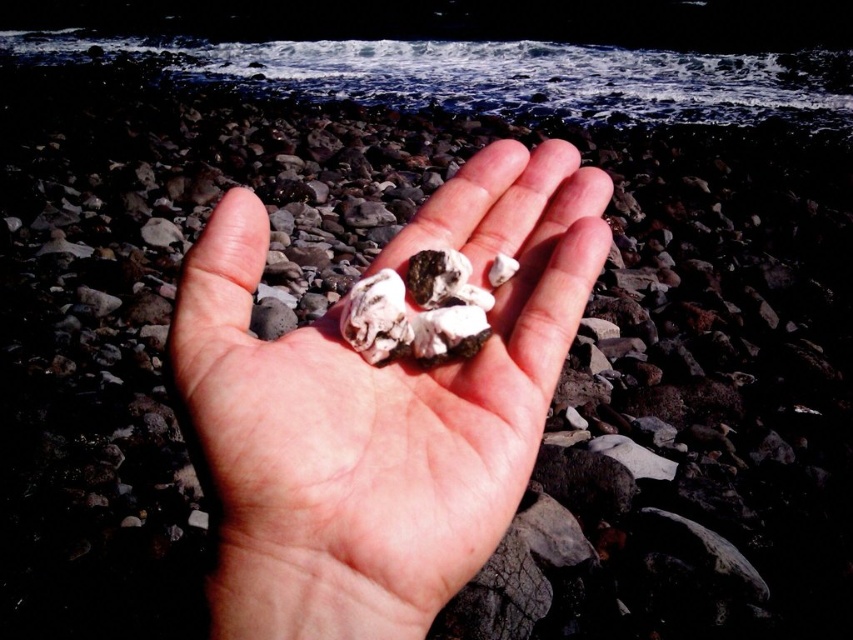
You are a geologist examining the stones in the image. You notice two objects at the center of the hand. Which object is closer to you, the white matte rocks at center or the white matte oyster at center?

The white matte rocks at center is closer to you because it is in front of the white matte oyster at center.

You are a geologist examining the stones in the image. The white matte rocks at center are part of your sample. Where exactly are they positioned relative to the other objects in the scene?

The white matte rocks at center are located at point (379, 408). This coordinate places them centrally in the frame, with the palm facing upwards, showcasing the stones held delicately between the fingers.